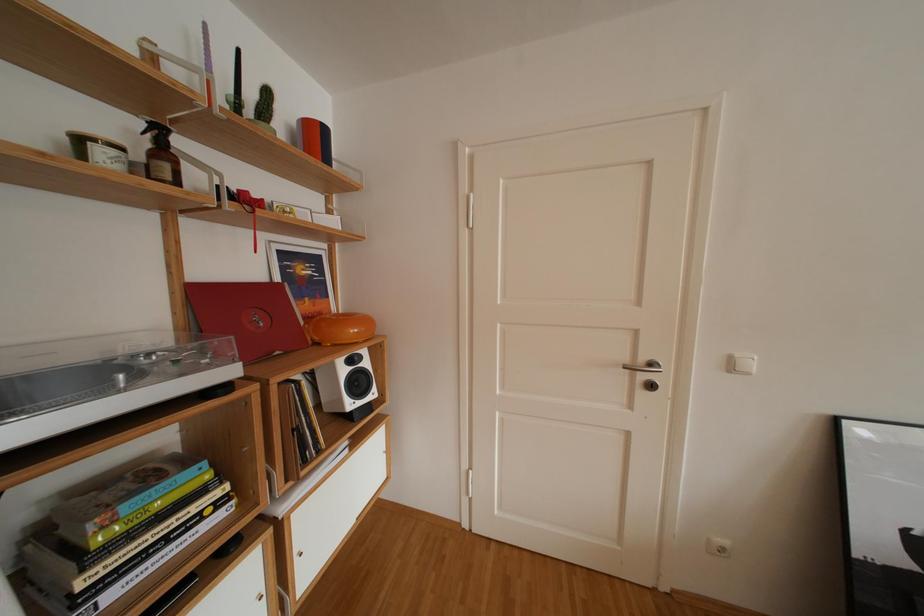
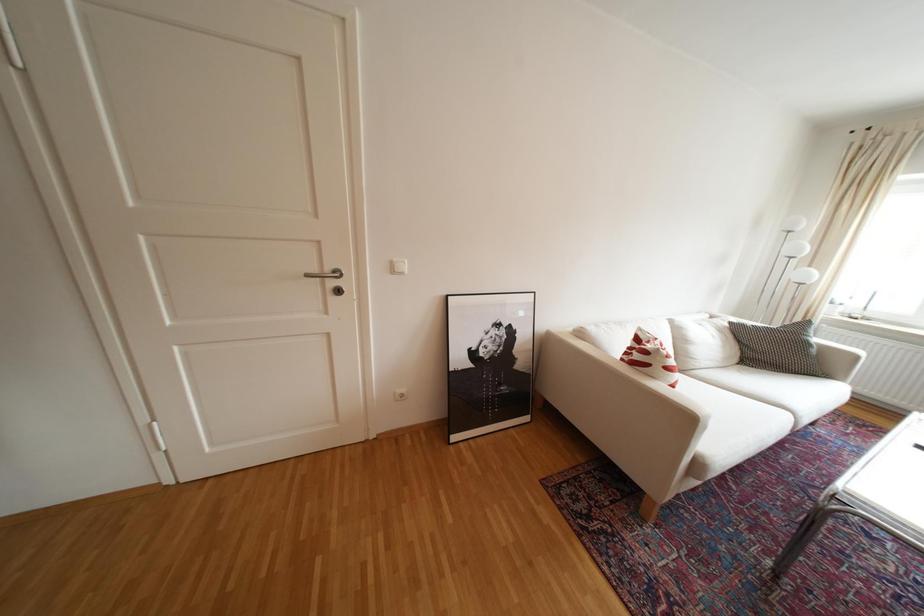
Question: How did the camera likely rotate?

Choices:
 (A) Left
 (B) Right
 (C) Up
 (D) Down

Answer: (B)